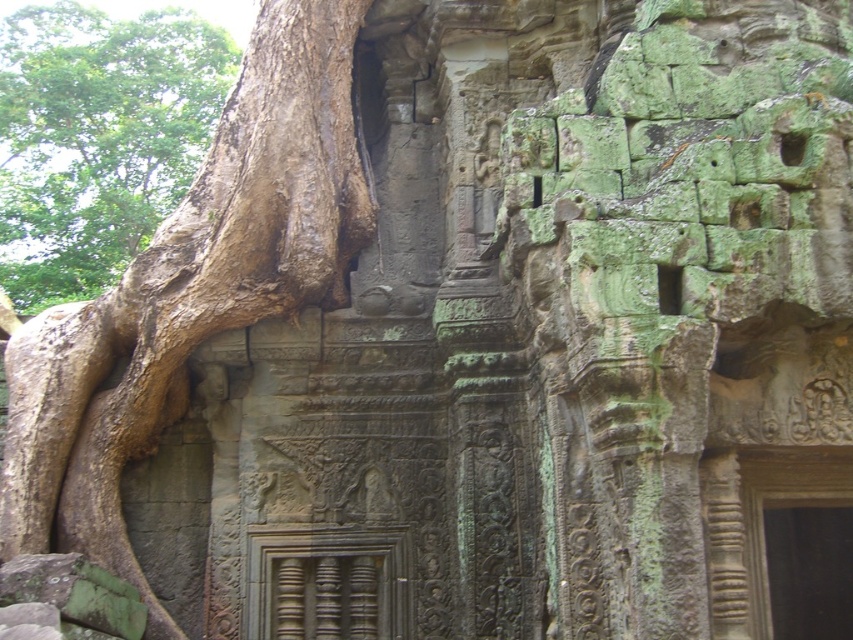
You are an archaeologist standing at the base of the ancient stone structure. You notice two features on the left side of the scene. One is the brown rough tree trunk at left and the other is the brown rough bark at left. Which of these two features is farther away from you?

The brown rough tree trunk at left is farther away from you since it is 80.60 meters away from the brown rough bark at left.

You are an archaeologist examining the ancient stone structure. You notice the brown rough tree trunk at left. Where exactly is it positioned in relation to the door frame at the bottom center?

The brown rough tree trunk at left is located at point coordinates approximately 0.453 on the x and 0.224 on the y axis, which places it to the left side of the door frame at the bottom center.